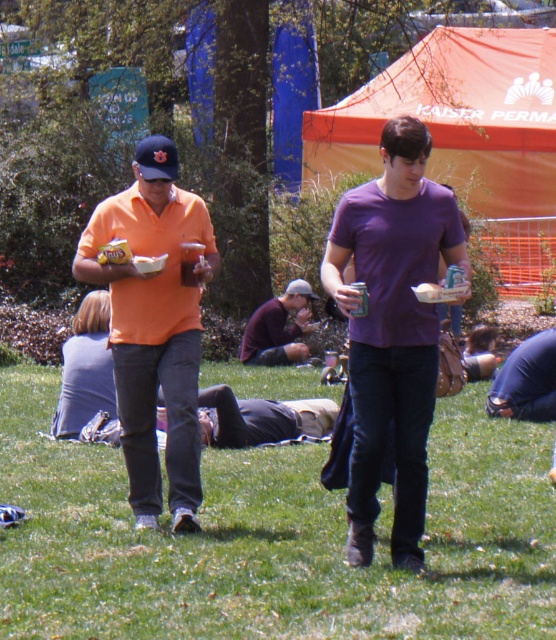
Question: Which is nearer to the purple cotton shirt at center?

Choices:
 (A) matte orange shirt at center
 (B) dark purple shirt at center
 (C) green grass at center

Answer: (A)

Question: Considering the real-world distances, which object is closest to the green grass at center?

Choices:
 (A) matte orange shirt at center
 (B) dark purple shirt at center

Answer: (A)

Question: Can you confirm if green grass at center is bigger than matte orange shirt at center?

Choices:
 (A) yes
 (B) no

Answer: (B)

Question: Which is nearer to the purple cotton shirt at center?

Choices:
 (A) dark purple shirt at center
 (B) green grass at center

Answer: (B)

Question: Considering the relative positions of purple cotton shirt at center and dark purple shirt at center in the image provided, where is purple cotton shirt at center located with respect to dark purple shirt at center?

Choices:
 (A) left
 (B) right

Answer: (B)

Question: Can you confirm if green grass at center is bigger than dark purple shirt at center?

Choices:
 (A) no
 (B) yes

Answer: (A)